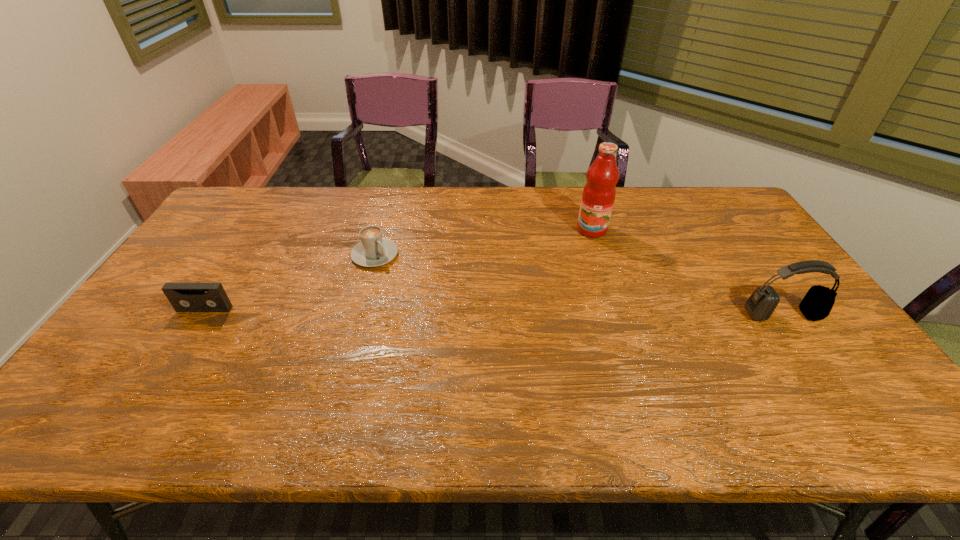
Identify the location of vacant space on the desktop that is between the leftmost object and the headset and is positioned on the front label of the fruit juice. This screenshot has height=540, width=960. (574, 313).

Find the location of a particular element. The width and height of the screenshot is (960, 540). vacant space on the desktop that is between the videotape and the rightmost object and is positioned to the right of the cappuccino is located at coordinates (436, 312).